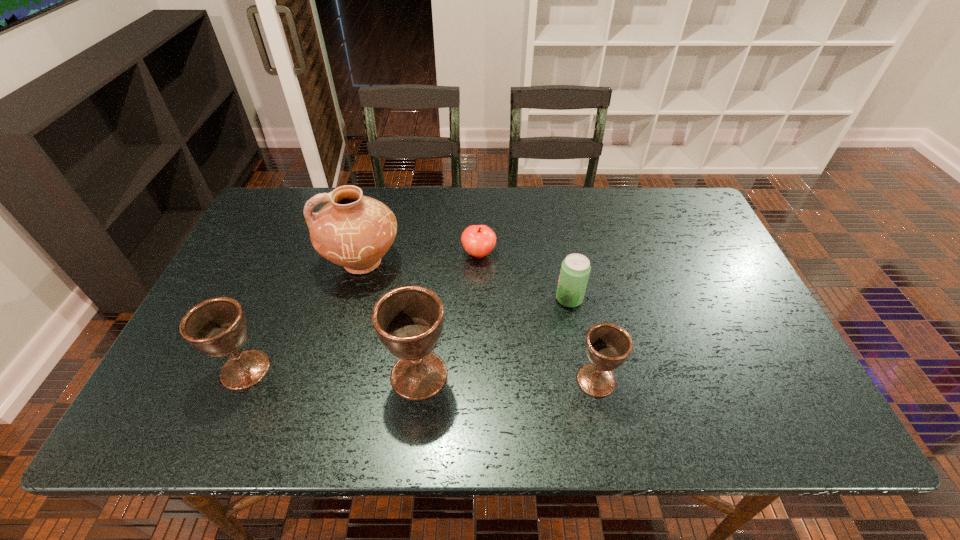
Find the location of a particular element. This screenshot has width=960, height=540. vacant space located on the left of the tallest chalice is located at coordinates (358, 375).

Image resolution: width=960 pixels, height=540 pixels. What are the coordinates of `vacant space located 0.390m on the left of the shortest chalice` in the screenshot? It's located at (401, 380).

Locate an element on the screen. The image size is (960, 540). free space located 0.120m on the right of the shortest object is located at coordinates (538, 254).

You are a GUI agent. You are given a task and a screenshot of the screen. Output one action in this format:
    pyautogui.click(x=<x>, y=<y>)
    Task: Click on the vacant space located on the side of the fifth object from right to left with the handle
    
    Given the screenshot: What is the action you would take?
    pyautogui.click(x=295, y=263)

Locate an element on the screen. blank space located on the side of the fifth object from right to left with the handle is located at coordinates (276, 263).

At what (x,y) coordinates should I click in order to perform the action: click on vacant space located on the side of the fifth object from right to left with the handle. Please return your answer as a coordinate pair (x, y). Image resolution: width=960 pixels, height=540 pixels. Looking at the image, I should click on (274, 263).

The image size is (960, 540). I want to click on blank space located on the left of the soda, so click(x=444, y=299).

Find the location of `object situated at the left edge`. object situated at the left edge is located at coordinates (217, 327).

Image resolution: width=960 pixels, height=540 pixels. In order to click on object positioned at the near left corner in this screenshot , I will do `click(217, 327)`.

Where is `free space at the far edge of the desktop`? The image size is (960, 540). free space at the far edge of the desktop is located at coordinates (397, 192).